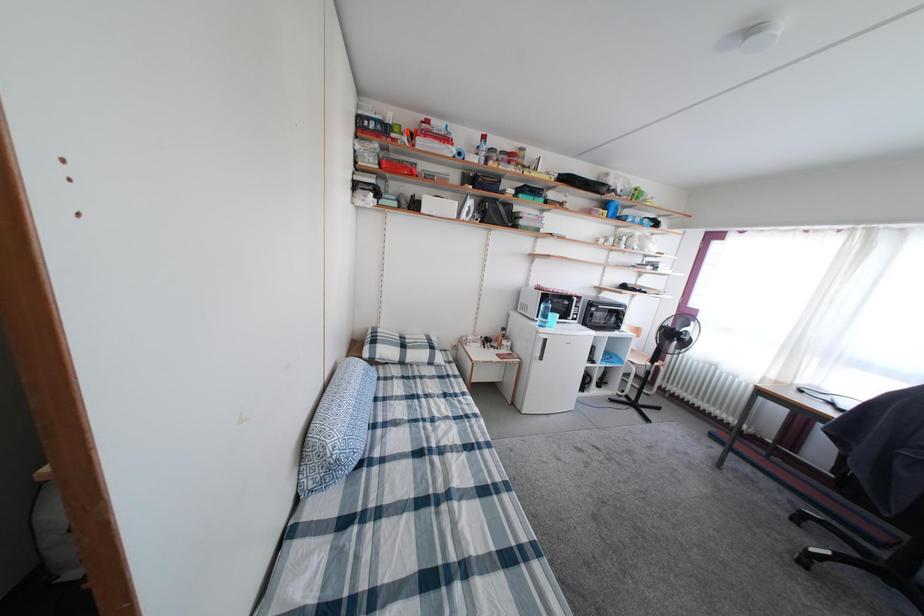
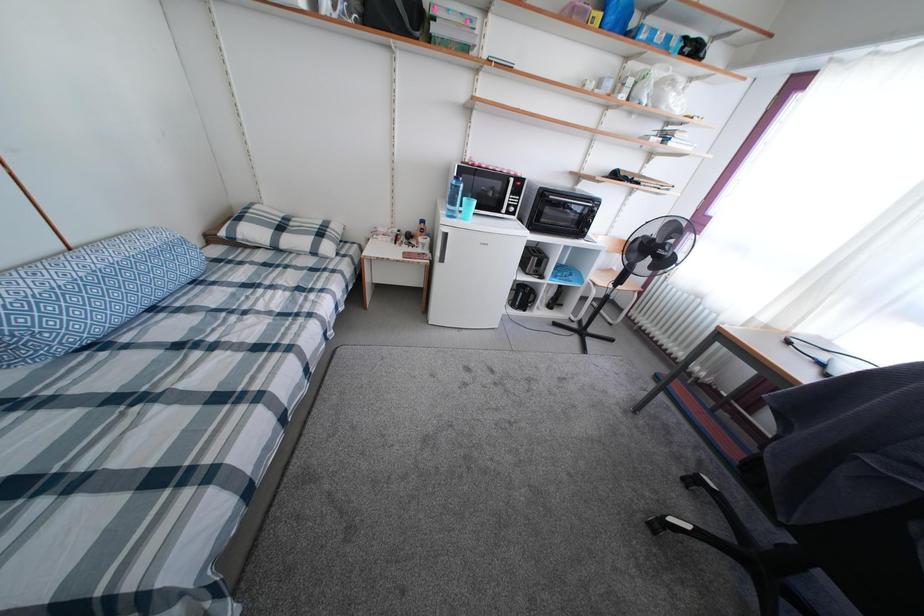
Looking at this image, in a continuous first-person perspective shot, in which direction is the camera moving?

The movement direction of the cameraman is right, forward.